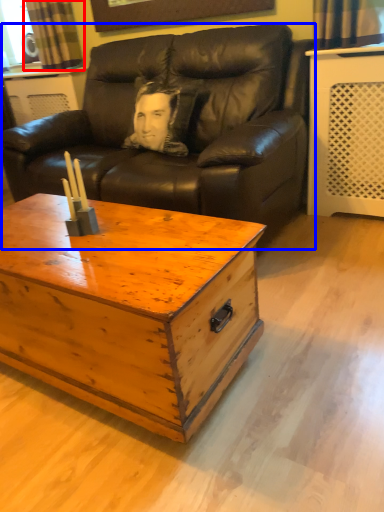
Question: Which of the following is the closest to the observer, curtain (highlighted by a red box) or studio couch (highlighted by a blue box)?

Choices:
 (A) curtain
 (B) studio couch

Answer: (B)